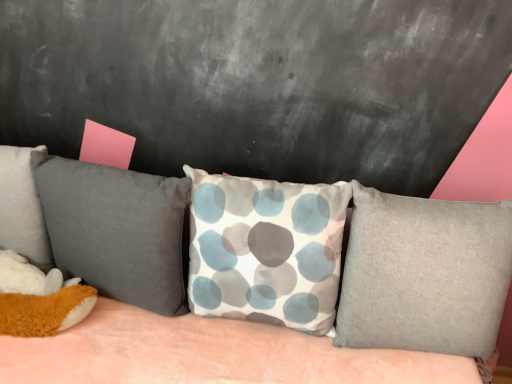
Question: From the image's perspective, is velvety gray pillow at left, which appears as the third pillow when viewed from the right, located beneath textured fabric couch at center?

Choices:
 (A) no
 (B) yes

Answer: (A)

Question: Does velvety gray pillow at left, positioned as the second pillow in left-to-right order, have a lesser height compared to textured fabric couch at center?

Choices:
 (A) no
 (B) yes

Answer: (B)

Question: Is velvety gray pillow at left, which appears as the third pillow when viewed from the right, located outside textured fabric couch at center?

Choices:
 (A) no
 (B) yes

Answer: (A)

Question: Is textured fabric couch at center located within velvety gray pillow at left, positioned as the second pillow in left-to-right order?

Choices:
 (A) no
 (B) yes

Answer: (A)

Question: Does velvety gray pillow at left, positioned as the second pillow in left-to-right order, have a larger size compared to textured fabric couch at center?

Choices:
 (A) yes
 (B) no

Answer: (B)

Question: Is velvety gray pillow at left, positioned as the second pillow in left-to-right order, situated inside white fabric pillow with blue and gray circles at center, the 3th pillow when ordered from left to right, or outside?

Choices:
 (A) inside
 (B) outside

Answer: (B)

Question: Is velvety gray pillow at left, which appears as the third pillow when viewed from the right, bigger or smaller than white fabric pillow with blue and gray circles at center, the 3th pillow when ordered from left to right?

Choices:
 (A) small
 (B) big

Answer: (A)

Question: From their relative heights in the image, would you say velvety gray pillow at left, which appears as the third pillow when viewed from the right, is taller or shorter than white fabric pillow with blue and gray circles at center, the 3th pillow when ordered from left to right?

Choices:
 (A) tall
 (B) short

Answer: (B)

Question: Is velvety gray pillow at left, positioned as the second pillow in left-to-right order, in front of or behind white fabric pillow with blue and gray circles at center, the 3th pillow when ordered from left to right, in the image?

Choices:
 (A) behind
 (B) front

Answer: (A)

Question: Considering the relative positions of velvety gray pillow at left, which appears as the third pillow when viewed from the right, and textured fabric couch at center in the image provided, is velvety gray pillow at left, which appears as the third pillow when viewed from the right, to the left or to the right of textured fabric couch at center?

Choices:
 (A) right
 (B) left

Answer: (B)

Question: In terms of width, does velvety gray pillow at left, positioned as the second pillow in left-to-right order, look wider or thinner when compared to textured fabric couch at center?

Choices:
 (A) thin
 (B) wide

Answer: (A)

Question: Does point (78, 170) appear closer or farther from the camera than point (424, 284)?

Choices:
 (A) closer
 (B) farther

Answer: (B)

Question: Would you say velvety gray pillow at left, which appears as the third pillow when viewed from the right, is inside or outside textured fabric couch at center?

Choices:
 (A) outside
 (B) inside

Answer: (B)

Question: From a real-world perspective, is textured fabric couch at center positioned above or below velvety gray pillow at left, which appears as the third pillow when viewed from the right?

Choices:
 (A) above
 (B) below

Answer: (B)

Question: Is textured fabric couch at center inside the boundaries of velvety gray pillow at left, which appears as the third pillow when viewed from the right, or outside?

Choices:
 (A) outside
 (B) inside

Answer: (A)